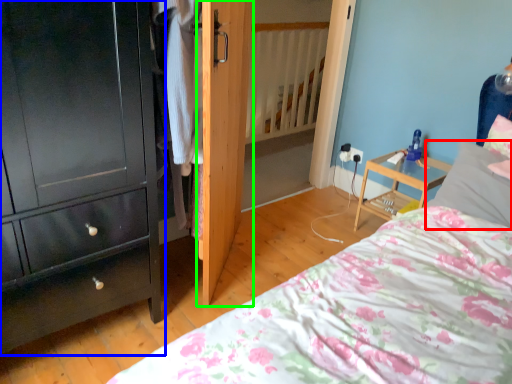
Question: Based on their relative distances, which object is nearer to pillow (highlighted by a red box)? Choose from chest of drawers (highlighted by a blue box) and door (highlighted by a green box).

Choices:
 (A) chest of drawers
 (B) door

Answer: (B)